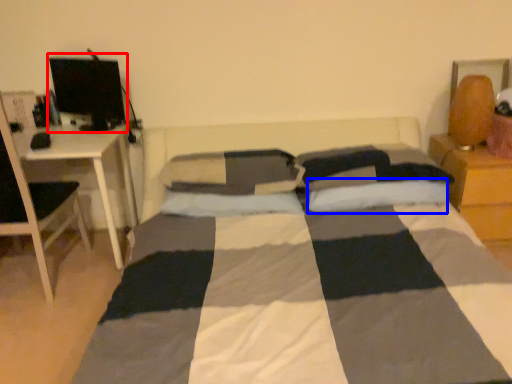
Question: Which object appears farthest to the camera in this image, computer monitor (highlighted by a red box) or pillow (highlighted by a blue box)?

Choices:
 (A) computer monitor
 (B) pillow

Answer: (A)